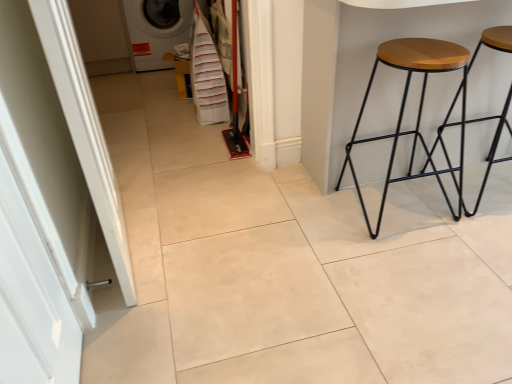
Locate an element on the screen. vacant space behind white glossy door at left is located at coordinates (138, 325).